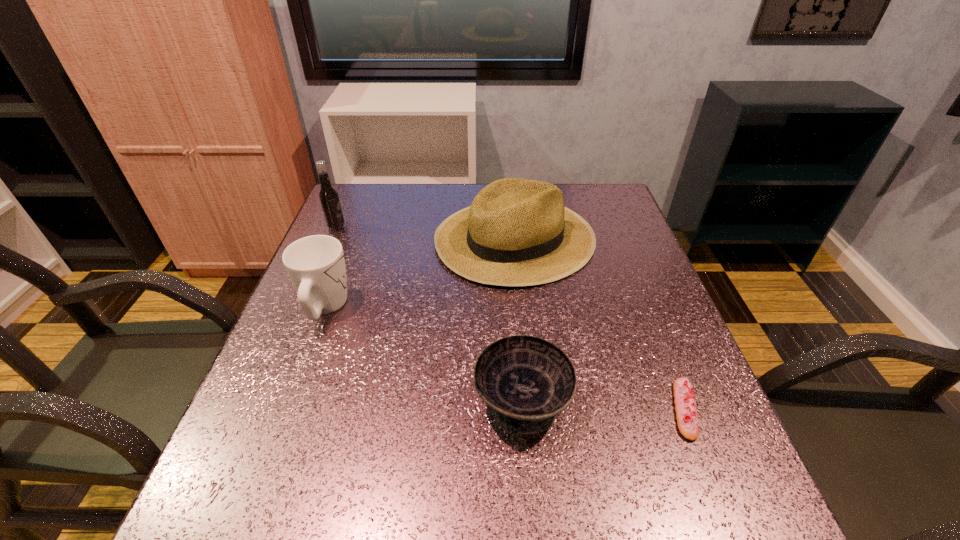
This screenshot has width=960, height=540. I want to click on object that is positioned at the far right corner, so click(x=517, y=232).

This screenshot has width=960, height=540. What are the coordinates of `vacant space at the far edge of the desktop` in the screenshot? It's located at (439, 195).

In order to click on vacant space at the near edge of the desktop in this screenshot , I will do `click(318, 486)`.

This screenshot has height=540, width=960. Identify the location of free space at the left edge. (279, 402).

The height and width of the screenshot is (540, 960). I want to click on vacant region at the right edge of the desktop, so tap(603, 281).

Identify the location of vacant space at the far left corner of the desktop. (341, 197).

Image resolution: width=960 pixels, height=540 pixels. I want to click on vacant space that is in between the second shortest object and the sunhat, so click(x=518, y=319).

This screenshot has width=960, height=540. Identify the location of free space between the second shortest object and the shortest object. (604, 405).

Locate an element on the screen. This screenshot has width=960, height=540. vacant space that's between the second shortest object and the mug is located at coordinates pos(423,354).

The image size is (960, 540). In order to click on empty location between the bowl and the mug in this screenshot , I will do `click(423, 354)`.